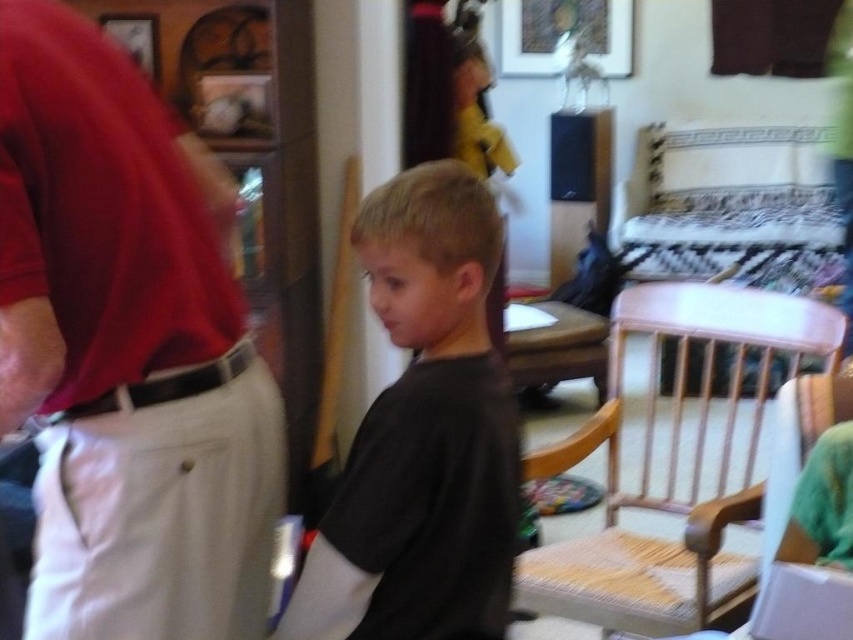
You are trying to locate the black matte shirt at center in the image. According to the coordinates provided, where exactly is it positioned?

The black matte shirt at center is located at point coordinates [422,435].

You are a photographer trying to capture a clear shot of the matte red shirt at left and the white woven wood chair at right. Given their sizes, which object would require a closer focus to ensure clarity?

The matte red shirt at left is thinner than the white woven wood chair at right, so the matte red shirt at left would require closer focus to ensure clarity.